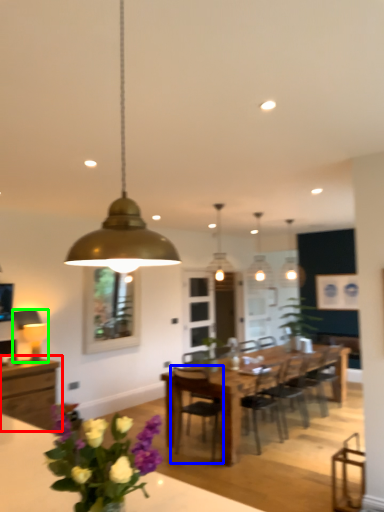
Question: Considering the real-world distances, which object is farthest from cabinetry (highlighted by a red box)? chair (highlighted by a blue box) or lamp (highlighted by a green box)?

Choices:
 (A) chair
 (B) lamp

Answer: (A)